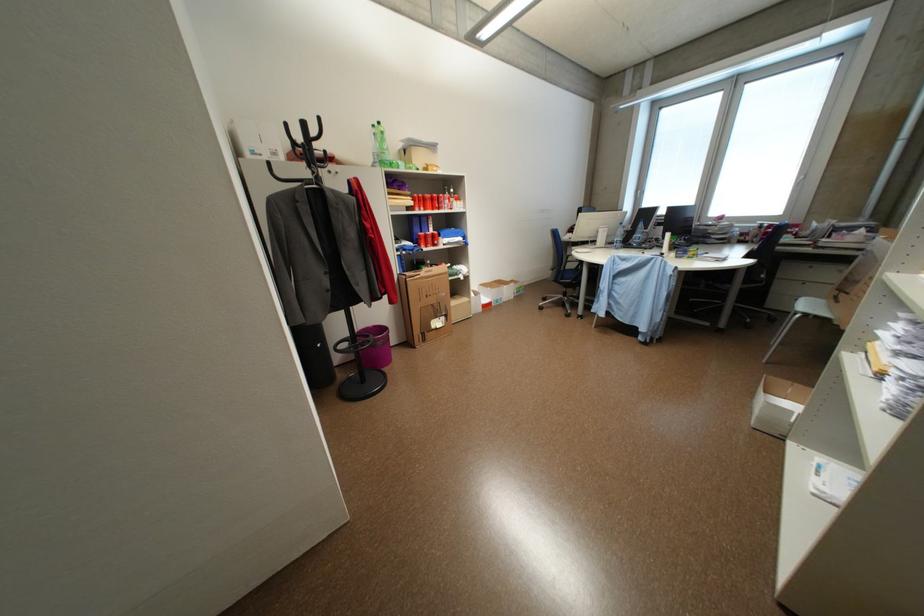
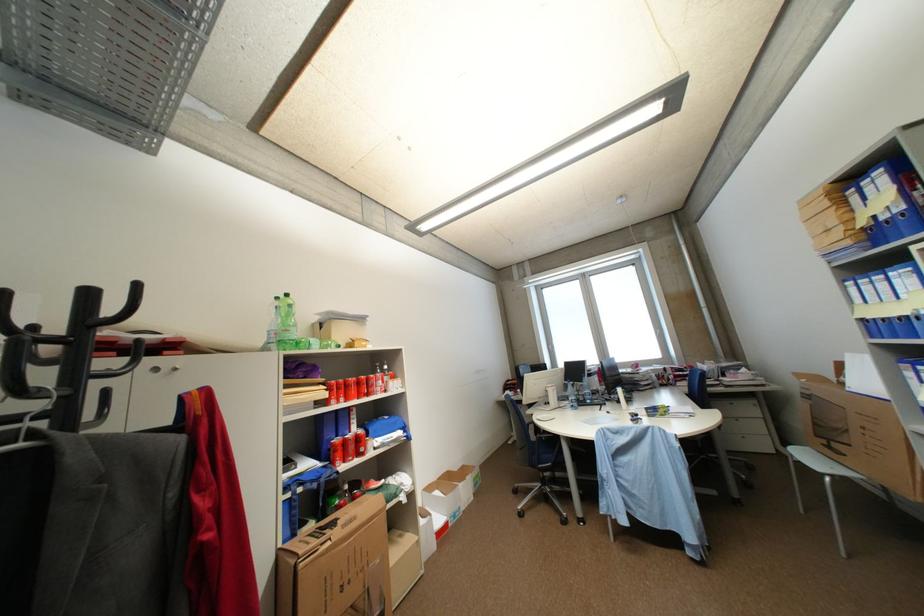
Locate, in the second image, the point that corresponds to (x=382, y=127) in the first image.

(286, 300)